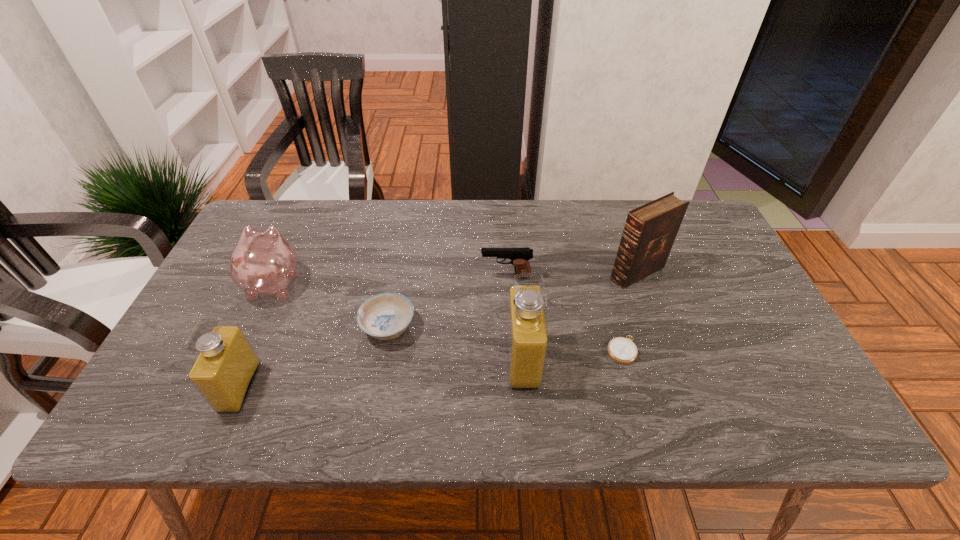
Where is `blank space located 0.360m on the front-facing side of the right perfume`? The height and width of the screenshot is (540, 960). blank space located 0.360m on the front-facing side of the right perfume is located at coordinates (354, 360).

This screenshot has height=540, width=960. What are the coordinates of `vacant space situated on the front-facing side of the right perfume` in the screenshot? It's located at (354, 360).

Image resolution: width=960 pixels, height=540 pixels. I want to click on free point located 0.300m on the front-facing side of the right perfume, so click(380, 360).

This screenshot has height=540, width=960. In order to click on free space located 0.140m at the barrel of the pistol in this screenshot , I will do [431, 277].

At what (x,y) coordinates should I click in order to perform the action: click on vacant space located at the barrel of the pistol. Please return your answer as a coordinate pair (x, y). Looking at the image, I should click on (402, 277).

This screenshot has width=960, height=540. In order to click on vacant region located at the barrel of the pistol in this screenshot , I will do `click(438, 277)`.

Image resolution: width=960 pixels, height=540 pixels. Find the location of `free point located 0.320m on the front of the Bible`. free point located 0.320m on the front of the Bible is located at coordinates (681, 395).

In order to click on blank area located on the left of the sixth tallest object in this screenshot , I will do `click(262, 327)`.

Identify the location of free space located on the front facing side of the piggy bank. The width and height of the screenshot is (960, 540). (309, 207).

The height and width of the screenshot is (540, 960). I want to click on free spot located 0.150m on the front facing side of the piggy bank, so click(300, 228).